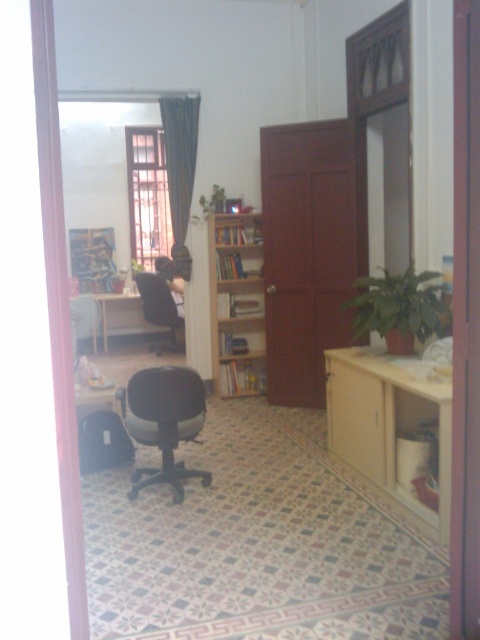
Question: Is dark green fabric curtain at upper center wider than black mesh office chair at center?

Choices:
 (A) yes
 (B) no

Answer: (B)

Question: Which object is the farthest from the matte black swivel chair at center?

Choices:
 (A) wooden cabinet at lower right
 (B) dark green fabric curtain at upper center
 (C) light brown wooden bookshelf at center
 (D) black mesh office chair at center

Answer: (D)

Question: Among these objects, which one is nearest to the camera?

Choices:
 (A) matte black swivel chair at center
 (B) black mesh office chair at center
 (C) wooden cabinet at lower right

Answer: (C)

Question: Can you confirm if wooden cabinet at lower right is smaller than black mesh office chair at center?

Choices:
 (A) yes
 (B) no

Answer: (B)

Question: Which point appears closest to the camera in this image?

Choices:
 (A) (170, 442)
 (B) (180, 109)
 (C) (441, 522)

Answer: (C)

Question: Does dark green fabric curtain at upper center have a lesser width compared to black mesh office chair at center?

Choices:
 (A) no
 (B) yes

Answer: (B)